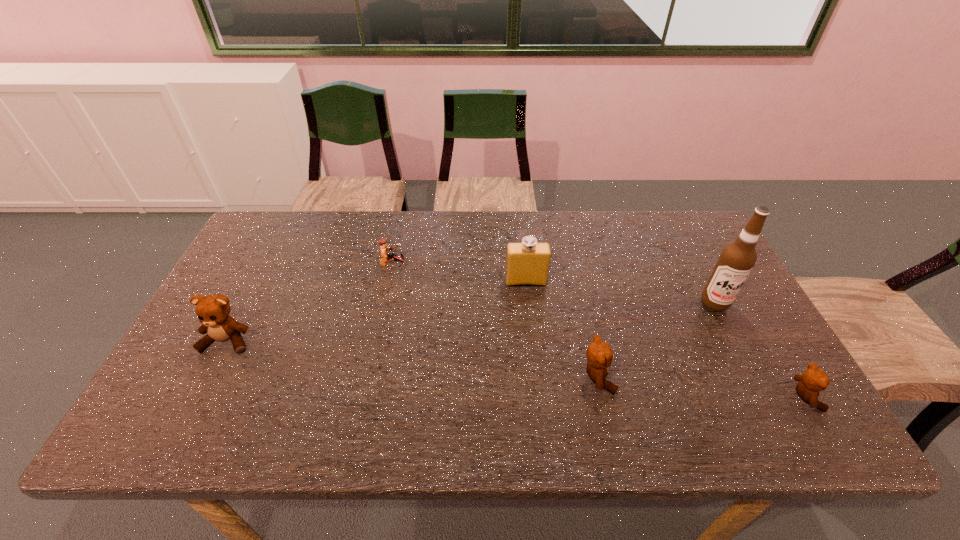
Locate an element on the screen. The image size is (960, 540). object that is the second closest to the rightmost object is located at coordinates click(599, 355).

Select which teddy bear appears as the second closest to the second teddy bear from left to right. Please provide its 2D coordinates. Your answer should be formatted as a tuple, i.e. [(x, y)], where the tuple contains the x and y coordinates of a point satisfying the conditions above.

[(213, 311)]

The image size is (960, 540). What are the coordinates of `the closest teddy bear to the rightmost object` in the screenshot? It's located at (599, 355).

What are the coordinates of `vacant space that satisfies the following two spatial constraints: 1. holding a crossbow in the hands of the fifth object from right to left; 2. on the front-facing side of the tallest teddy bear` in the screenshot? It's located at (377, 341).

You are a GUI agent. You are given a task and a screenshot of the screen. Output one action in this format:
    pyautogui.click(x=<x>, y=<y>)
    Task: Click on the vacant space that satisfies the following two spatial constraints: 1. on the label of the fifth object from left to right; 2. on the front-facing side of the second shortest teddy bear
    
    Given the screenshot: What is the action you would take?
    pyautogui.click(x=754, y=377)